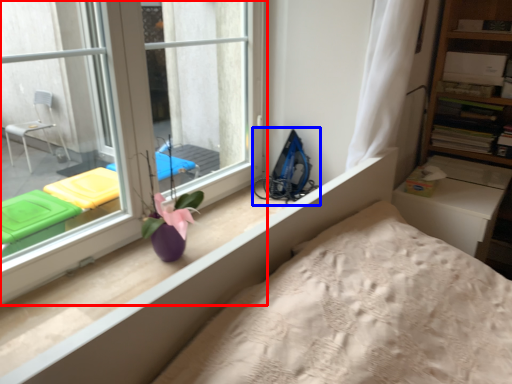
Question: Which point is closer to the camera, window (highlighted by a red box) or equipment (highlighted by a blue box)?

Choices:
 (A) window
 (B) equipment

Answer: (A)